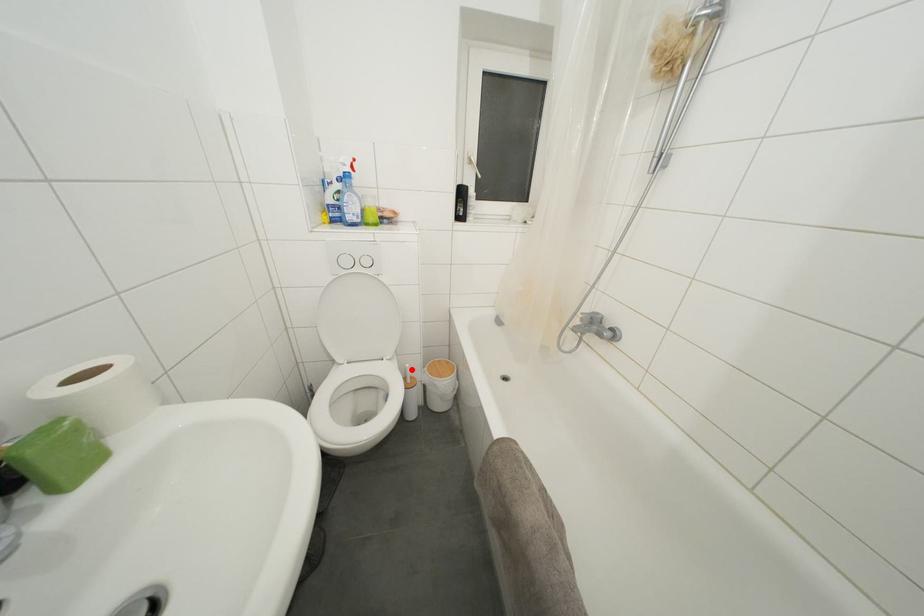
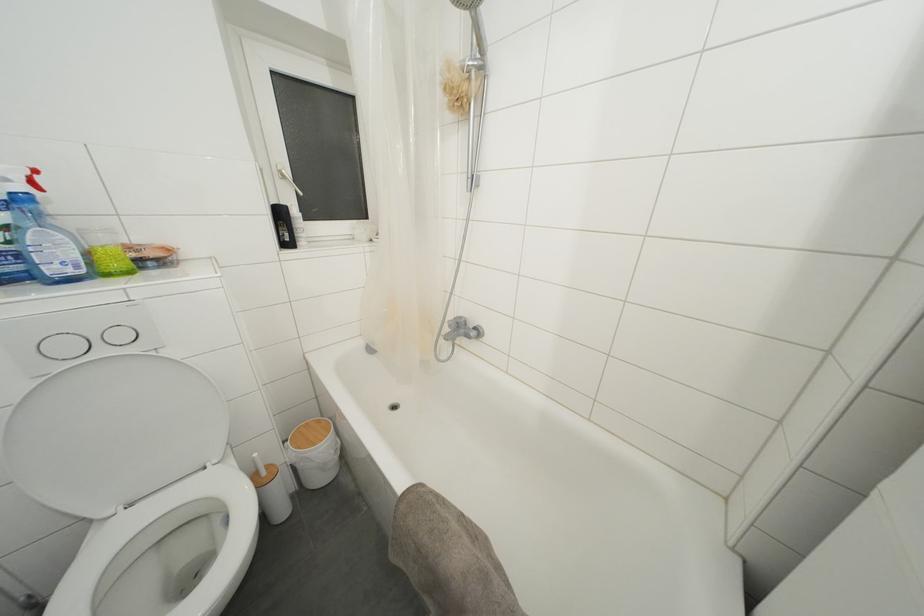
Question: A red point is marked in image1. In image2, is the corresponding 3D point closer to the camera or farther? Reply with the corresponding letter.

Choices:
 (A) The corresponding 3D point is closer.
 (B) The corresponding 3D point is farther.

Answer: (A)